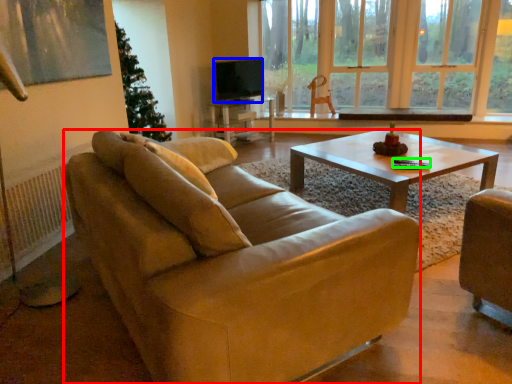
Question: Considering the real-world distances, which object is closest to studio couch (highlighted by a red box)? television (highlighted by a blue box) or corded phone (highlighted by a green box).

Choices:
 (A) television
 (B) corded phone

Answer: (B)